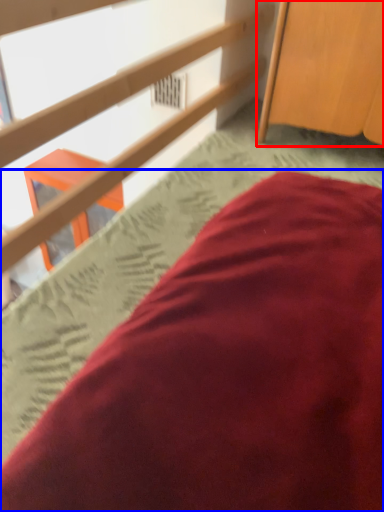
Question: Which point is closer to the camera, furniture (highlighted by a red box) or bed (highlighted by a blue box)?

Choices:
 (A) furniture
 (B) bed

Answer: (B)